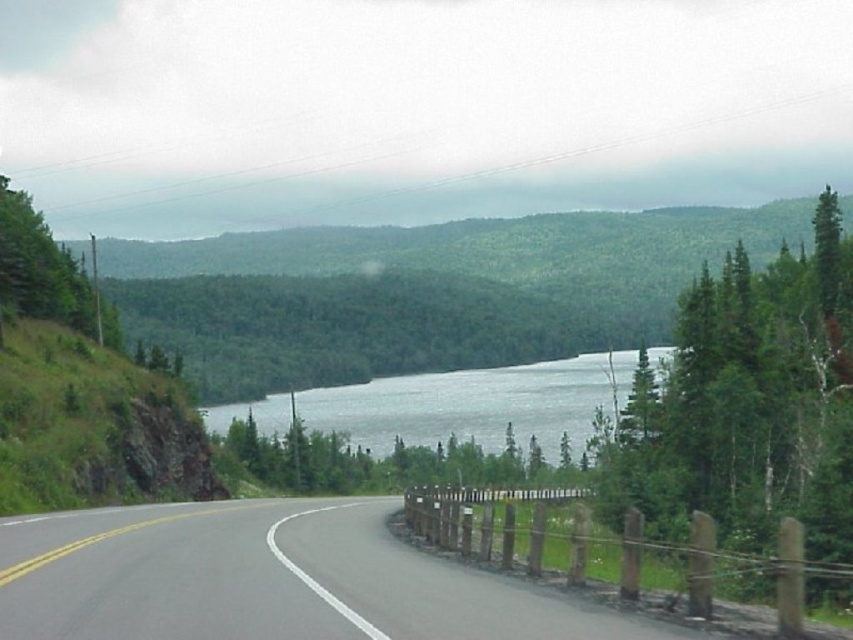
Question: Is gray asphalt highway at center smaller than green leafy tree at upper right?

Choices:
 (A) no
 (B) yes

Answer: (B)

Question: Which point is farther to the camera?

Choices:
 (A) gray asphalt highway at center
 (B) clear water at center
 (C) green leafy tree at upper right

Answer: (B)

Question: Can you confirm if gray asphalt highway at center is thinner than clear water at center?

Choices:
 (A) no
 (B) yes

Answer: (B)

Question: Does green leafy tree at upper right lie behind clear water at center?

Choices:
 (A) yes
 (B) no

Answer: (B)

Question: Among these points, which one is nearest to the camera?

Choices:
 (A) (345, 538)
 (B) (537, 378)

Answer: (A)

Question: Which object is the farthest from the gray asphalt highway at center?

Choices:
 (A) clear water at center
 (B) green leafy tree at upper right

Answer: (A)